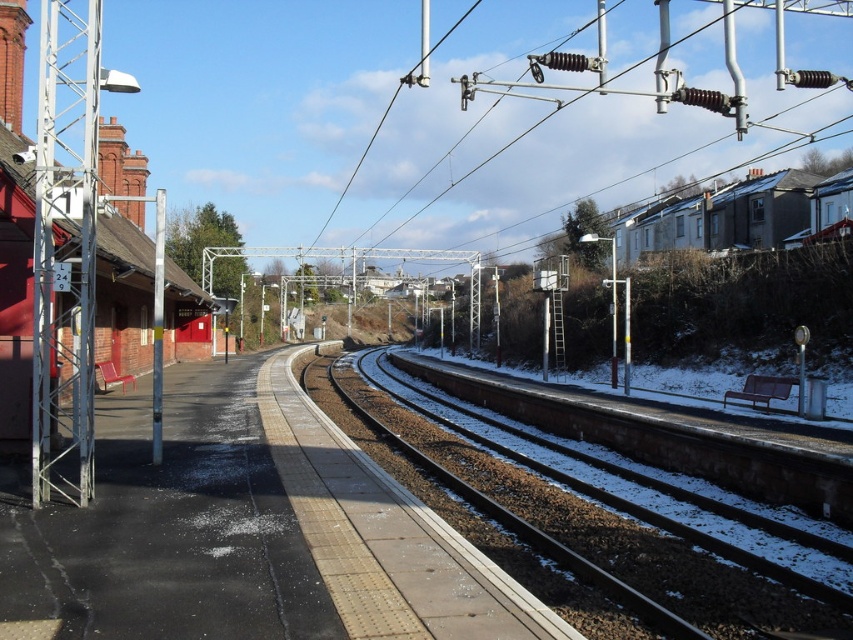
You are standing on the platform at the railway station and notice two points marked on the tracks ahead of you. The first point is at coordinate point(755,600) and the second is at point(775,230). Which of these two points is closer to your current position?

Point(755,600) is closer to the viewer than point(775,230), so the first point is closer to your current position.

You are a passenger waiting at the railway station. You see the brown gravel track at center and the white matte houses at upper right. Which one is closer to you on the platform?

The brown gravel track at center is closer to you than the white matte houses at upper right because it is in front of them.

You are a passenger waiting at the railway station and want to board the train that will arrive along the brown gravel track at center. To get a better view of the approaching train, should you stand closer to the white matte houses at upper right or move away from them?

You should stand closer to the white matte houses at upper right because the brown gravel track at center is positioned under them, so standing near the houses will give you a better vantage point to see the train as it comes along the track.